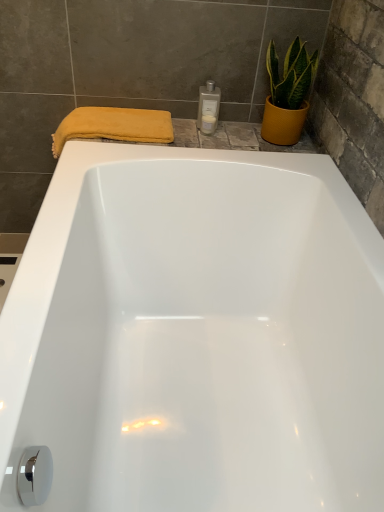
Find the location of a particular element. This screenshot has width=384, height=512. vacant space in between yellow textured pot at upper right and white glossy bottle at upper center, which is the first toiletry from bottom to top is located at coordinates (235, 136).